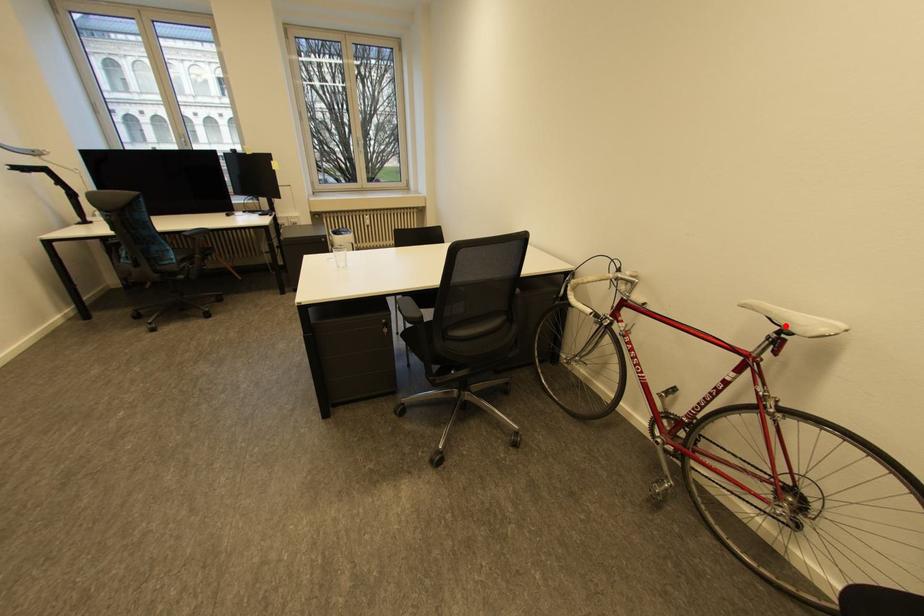
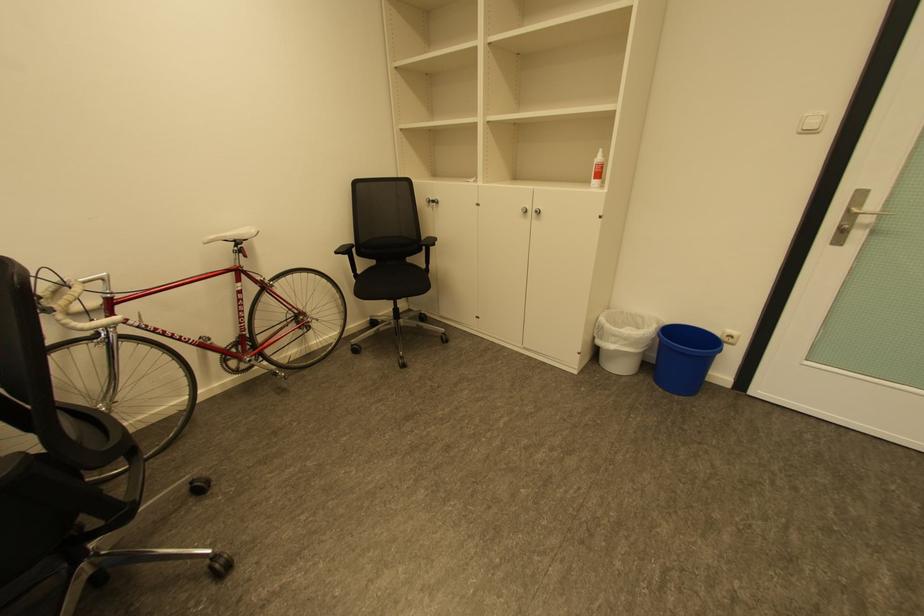
The point at the highlighted location is marked in the first image. Where is the corresponding point in the second image?

(241, 241)